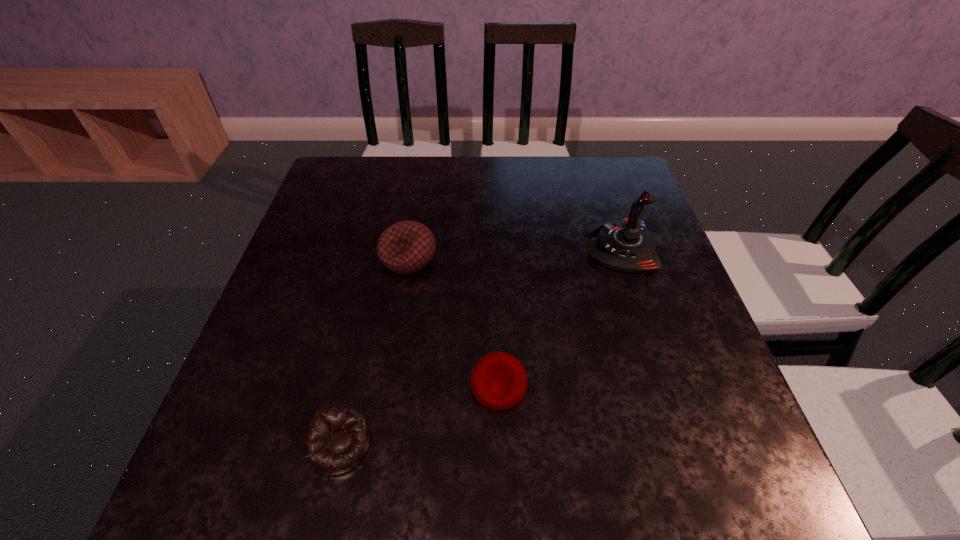
Identify the location of blank space located on the handle side of the joystick. (499, 246).

Where is `vacant space located on the front of the third shortest object`? The image size is (960, 540). vacant space located on the front of the third shortest object is located at coordinates (381, 423).

Locate an element on the screen. vacant point located on the seat area of the rightmost beanbag is located at coordinates (500, 439).

You are a GUI agent. You are given a task and a screenshot of the screen. Output one action in this format:
    pyautogui.click(x=<x>, y=<y>)
    Task: Click on the vacant area situated on the right of the nearest object
    
    Given the screenshot: What is the action you would take?
    pyautogui.click(x=502, y=444)

You are a GUI agent. You are given a task and a screenshot of the screen. Output one action in this format:
    pyautogui.click(x=<x>, y=<y>)
    Task: Click on the object present at the near edge
    Image resolution: width=960 pixels, height=540 pixels.
    Given the screenshot: What is the action you would take?
    pyautogui.click(x=336, y=439)

Find the location of a particular element. The width and height of the screenshot is (960, 540). object positioned at the right edge is located at coordinates [x=625, y=244].

In the image, there is a desktop. Where is `blank space at the far edge`? The height and width of the screenshot is (540, 960). blank space at the far edge is located at coordinates (408, 176).

Find the location of a particular element. The height and width of the screenshot is (540, 960). vacant area at the near edge is located at coordinates pos(523,469).

Where is `free region at the left edge`? Image resolution: width=960 pixels, height=540 pixels. free region at the left edge is located at coordinates (312, 323).

Identify the location of vacant space at the right edge. (682, 285).